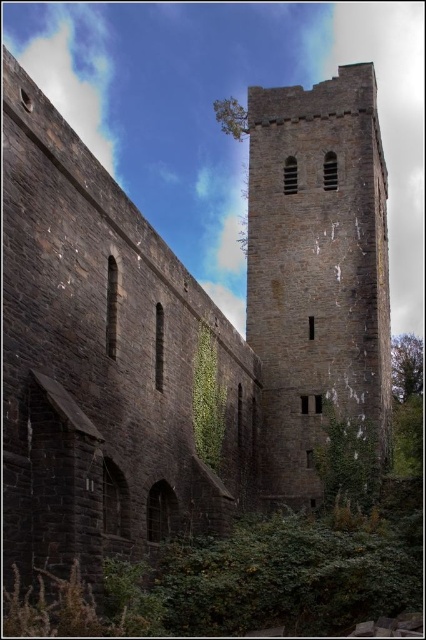
You are a gardener assessing the ivy growth on the castle walls. You notice two types of ivy, the green rough ivy at lower right and the green leafy ivy at center. Which ivy is taller?

The green leafy ivy at center is taller than the green rough ivy at lower right.

You are a visitor standing in front of the historic stone structure. You notice the dark gray stone tower at center and the green rough ivy at lower right. Which object is closer to you?

The dark gray stone tower at center is closer to you because the green rough ivy at lower right is behind it.

You are an architect examining the historic stone structure. You notice the dark gray stone tower at center and the green leafy ivy at center. Which of these two objects is taller?

The dark gray stone tower at center is taller than the green leafy ivy at center.